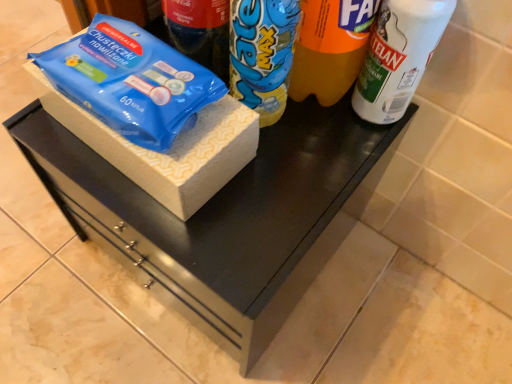
Question: From a real-world perspective, is white matte spray can at upper right beneath wooden box at center?

Choices:
 (A) no
 (B) yes

Answer: (A)

Question: From the image's perspective, is white matte spray can at upper right on wooden box at center?

Choices:
 (A) yes
 (B) no

Answer: (A)

Question: Can we say white matte spray can at upper right lies outside wooden box at center?

Choices:
 (A) yes
 (B) no

Answer: (A)

Question: Can you confirm if white matte spray can at upper right is positioned to the left of wooden box at center?

Choices:
 (A) no
 (B) yes

Answer: (A)

Question: Does white matte spray can at upper right come in front of wooden box at center?

Choices:
 (A) yes
 (B) no

Answer: (A)

Question: Considering their positions, is blue plastic wipes at left located in front of or behind yellow matte drinking straw at center?

Choices:
 (A) front
 (B) behind

Answer: (B)

Question: Is blue plastic wipes at left situated inside yellow matte drinking straw at center or outside?

Choices:
 (A) outside
 (B) inside

Answer: (A)

Question: From a real-world perspective, is blue plastic wipes at left physically located above or below yellow matte drinking straw at center?

Choices:
 (A) above
 (B) below

Answer: (B)

Question: Does point (47, 62) appear closer or farther from the camera than point (342, 8)?

Choices:
 (A) closer
 (B) farther

Answer: (B)

Question: From the image's perspective, is yellow matte drinking straw at center positioned above or below blue plastic wipes at left?

Choices:
 (A) below
 (B) above

Answer: (B)

Question: In the image, is yellow matte drinking straw at center positioned in front of or behind blue plastic wipes at left?

Choices:
 (A) front
 (B) behind

Answer: (A)

Question: Is yellow matte drinking straw at center situated inside blue plastic wipes at left or outside?

Choices:
 (A) outside
 (B) inside

Answer: (A)

Question: Is yellow matte drinking straw at center to the left or to the right of blue plastic wipes at left in the image?

Choices:
 (A) left
 (B) right

Answer: (B)

Question: From the image's perspective, is wooden box at center located above or below white matte spray can at upper right?

Choices:
 (A) below
 (B) above

Answer: (A)

Question: Would you say wooden box at center is to the left or to the right of white matte spray can at upper right in the picture?

Choices:
 (A) left
 (B) right

Answer: (A)